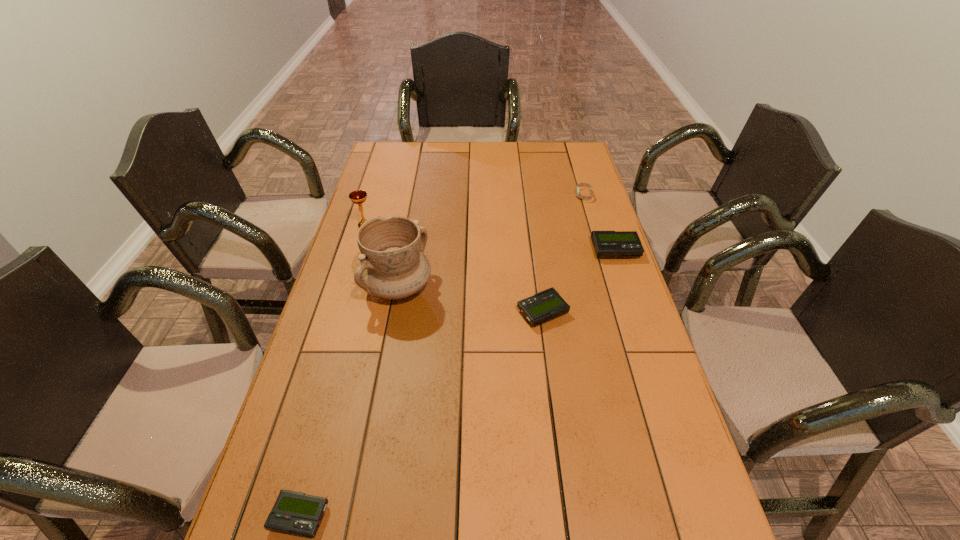
The image size is (960, 540). What are the coordinates of `blank region between the tallest object and the watch` in the screenshot? It's located at (492, 241).

You are a GUI agent. You are given a task and a screenshot of the screen. Output one action in this format:
    pyautogui.click(x=<x>, y=<y>)
    Task: Click on the object that ranks as the fifth closest to the farthest object
    The width and height of the screenshot is (960, 540).
    Given the screenshot: What is the action you would take?
    pyautogui.click(x=295, y=513)

Locate an element on the screen. The image size is (960, 540). object that stands as the second closest to the watch is located at coordinates (548, 304).

The width and height of the screenshot is (960, 540). In order to click on beeper identified as the third closest to the watch in this screenshot , I will do `click(295, 513)`.

Point out which beeper is positioned as the second nearest to the farthest object. Please provide its 2D coordinates. Your answer should be formatted as a tuple, i.e. [(x, y)], where the tuple contains the x and y coordinates of a point satisfying the conditions above.

[(548, 304)]

Where is `free region that satisfies the following two spatial constraints: 1. on the face of the farthest object; 2. on the back side of the tallest beeper`? The width and height of the screenshot is (960, 540). free region that satisfies the following two spatial constraints: 1. on the face of the farthest object; 2. on the back side of the tallest beeper is located at coordinates (600, 251).

Locate an element on the screen. The width and height of the screenshot is (960, 540). free point that satisfies the following two spatial constraints: 1. on the back side of the pottery; 2. on the right side of the tallest beeper is located at coordinates (405, 251).